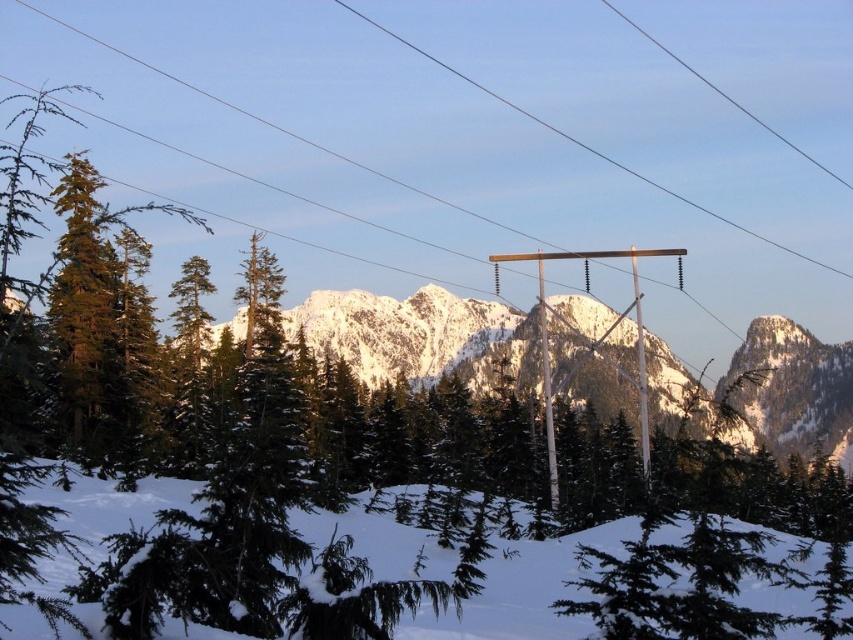
Looking at this image, can you confirm if snowy granite mountain range at center is positioned to the right of wooden pole at center?

Incorrect, snowy granite mountain range at center is not on the right side of wooden pole at center.

Is point (474, 308) more distant than point (625, 172)?

No, it is not.

Is point (346, 339) more distant than point (492, 96)?

That is False.

Where is `snowy granite mountain range at center`? The image size is (853, 640). snowy granite mountain range at center is located at coordinates (418, 336).

Who is positioned more to the left, snowy pine trees at lower center or wooden pole at center?

snowy pine trees at lower center is more to the left.

Identify the location of snowy pine trees at lower center. (521, 592).

Is point (651, 396) positioned after point (415, 541)?

That is True.

Which is more to the right, snowy granite mountain range at center or snowy pine trees at lower center?

From the viewer's perspective, snowy granite mountain range at center appears more on the right side.

Measure the distance between point (x=370, y=362) and camera.

They are 280.91 meters apart.

Where is `snowy granite mountain range at center`? snowy granite mountain range at center is located at coordinates (418, 336).